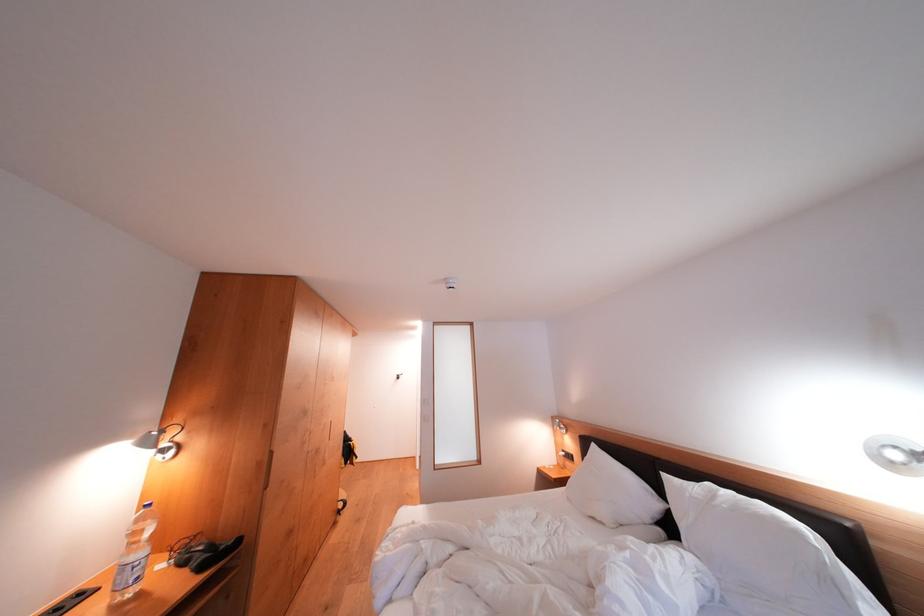
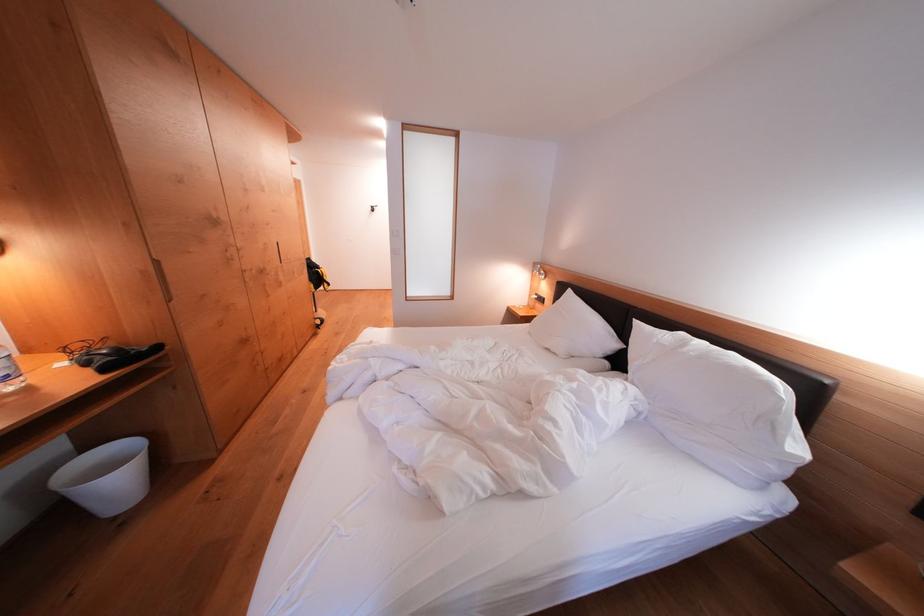
Locate, in the second image, the point that corresponds to point (672, 480) in the first image.

(642, 326)